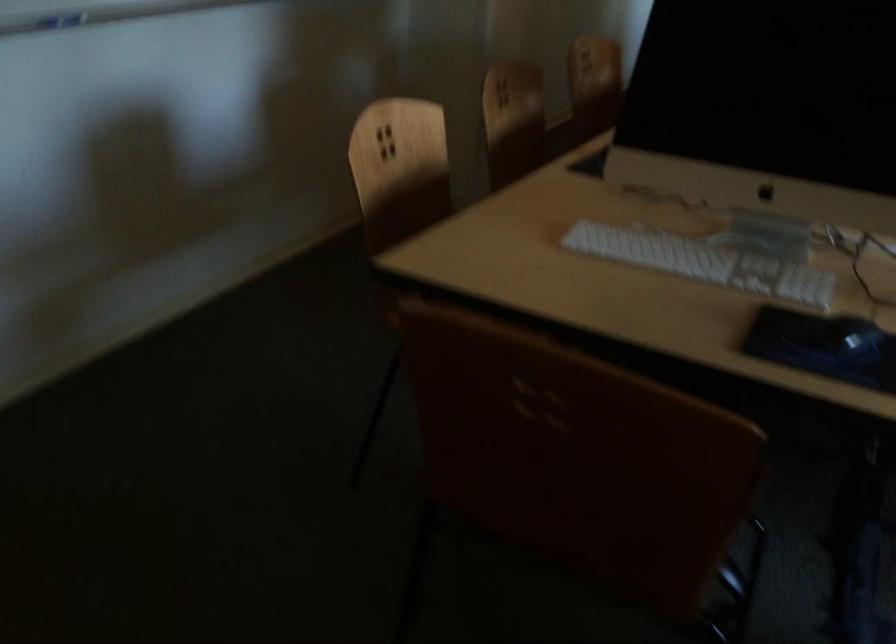
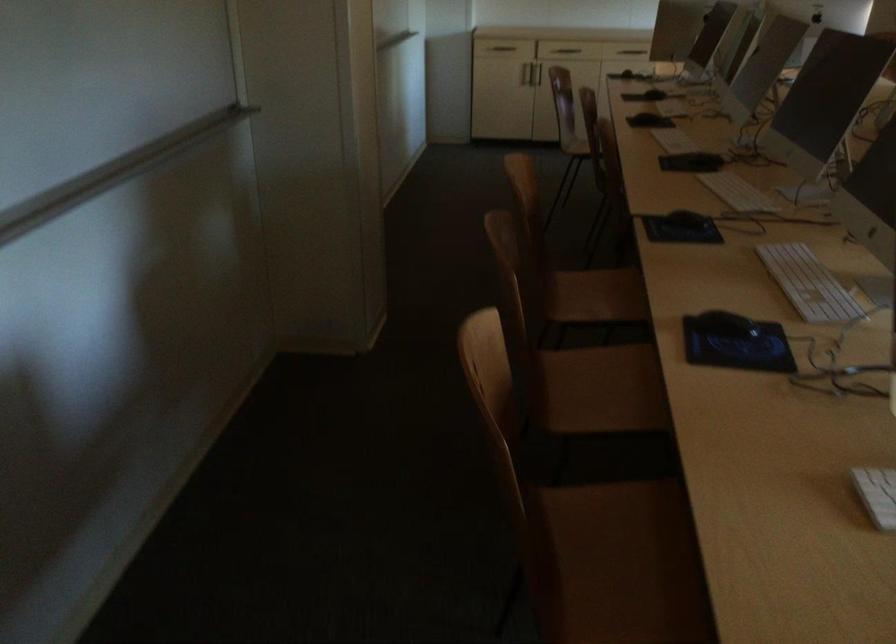
Question: How did the camera likely rotate?

Choices:
 (A) Left
 (B) Right
 (C) Up
 (D) Down

Answer: (B)